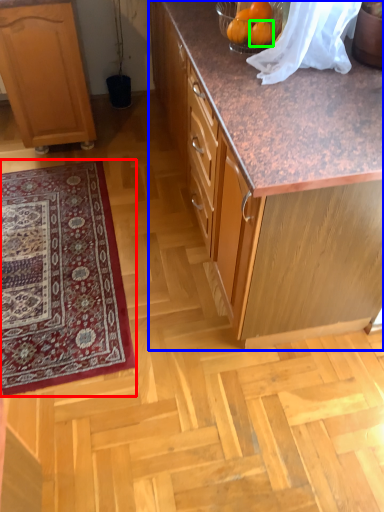
Question: Estimate the real-world distances between objects in this image. Which object is closer to mat (highlighted by a red box), cabinetry (highlighted by a blue box) or orange (highlighted by a green box)?

Choices:
 (A) cabinetry
 (B) orange

Answer: (A)